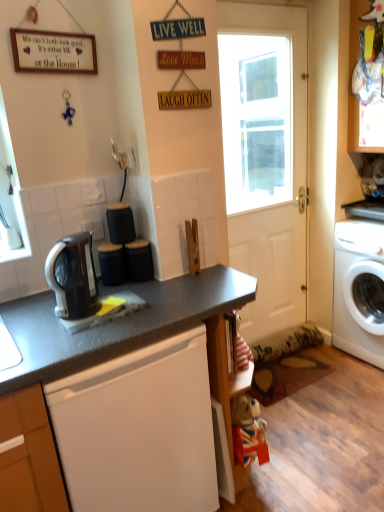
Locate an element on the screen. free space in front of black fabric ottoman at center, the 2th appliance from the left is located at coordinates (143, 293).